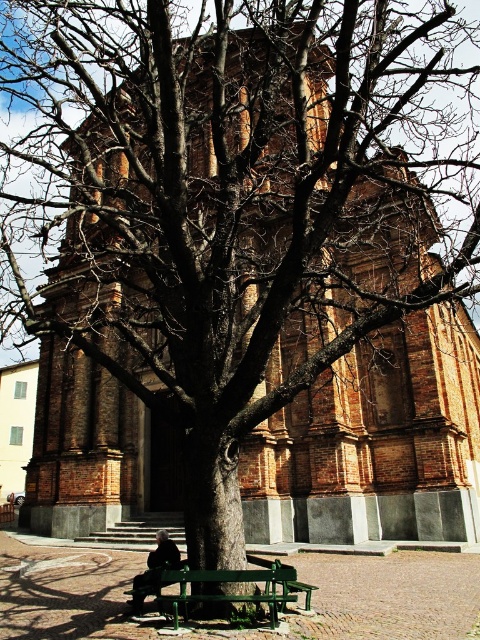
Question: Which point is farther to the camera?

Choices:
 (A) (163, 566)
 (B) (235, 602)

Answer: (A)

Question: In this image, where is green painted wood bench at lower center located relative to dark gray fabric coat at lower center?

Choices:
 (A) above
 (B) below

Answer: (B)

Question: Among these points, which one is nearest to the camera?

Choices:
 (A) (148, 588)
 (B) (168, 566)

Answer: (A)

Question: Considering the relative positions of green painted wood bench at lower center and dark gray fabric coat at lower center in the image provided, where is green painted wood bench at lower center located with respect to dark gray fabric coat at lower center?

Choices:
 (A) left
 (B) right

Answer: (B)

Question: From the image, what is the correct spatial relationship of green painted wood bench at lower center in relation to dark gray fabric coat at lower center?

Choices:
 (A) right
 (B) left

Answer: (A)